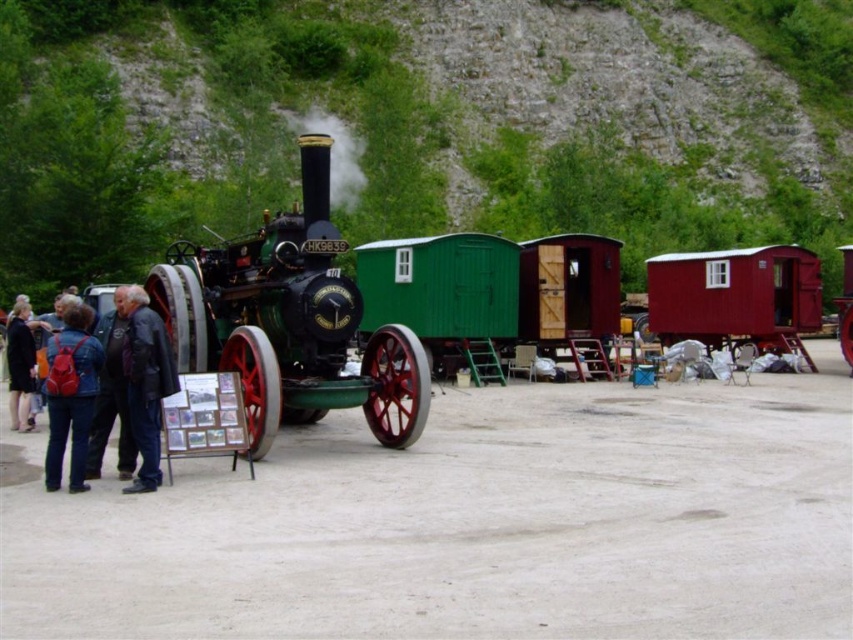
Does red backpack at lower left lie behind black leather jacket at lower left?

No.

Who is higher up, red backpack at lower left or black leather jacket at lower left?

black leather jacket at lower left is higher up.

Which is in front, point (67, 368) or point (132, 348)?

Point (67, 368) is more forward.

Where is `red backpack at lower left`? Image resolution: width=853 pixels, height=640 pixels. red backpack at lower left is located at coordinates (71, 396).

Can you confirm if black leather jacket at lower left is smaller than dark blue jacket at lower left?

Correct, black leather jacket at lower left occupies less space than dark blue jacket at lower left.

Is black leather jacket at lower left taller than dark blue jacket at lower left?

Correct, black leather jacket at lower left is much taller as dark blue jacket at lower left.

Identify the location of black leather jacket at lower left. This screenshot has width=853, height=640. (146, 381).

From the picture: Is smooth wooden cabin at right above dark blue jacket at lower left?

Yes, smooth wooden cabin at right is above dark blue jacket at lower left.

Between smooth wooden cabin at right and dark blue jacket at lower left, which one has more height?

With more height is smooth wooden cabin at right.

Between point (708, 298) and point (10, 362), which one is positioned behind?

Positioned behind is point (708, 298).

Where is `smooth wooden cabin at right`? Image resolution: width=853 pixels, height=640 pixels. smooth wooden cabin at right is located at coordinates (735, 298).